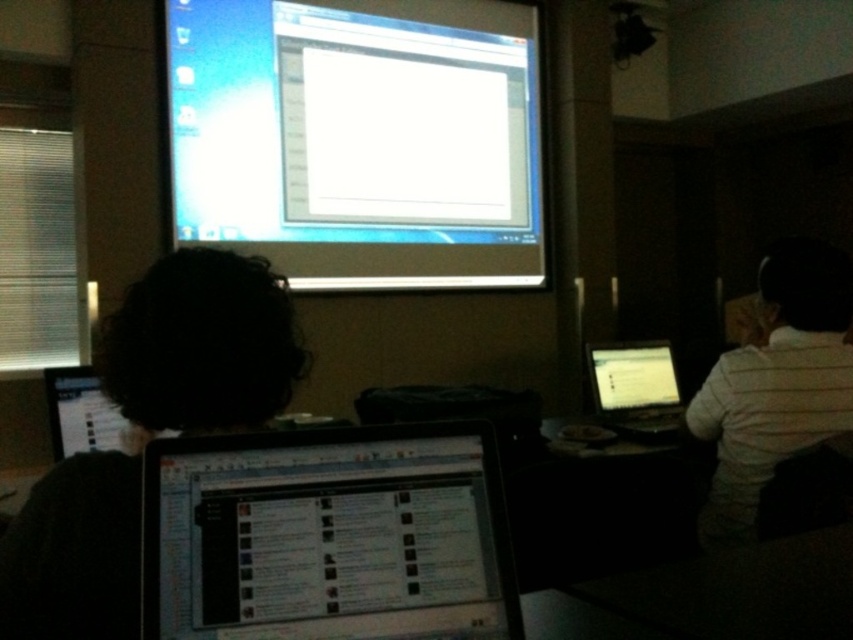
Question: Considering the relative positions of white glossy projector screen at upper center and white striped shirt at right in the image provided, where is white glossy projector screen at upper center located with respect to white striped shirt at right?

Choices:
 (A) left
 (B) right

Answer: (A)

Question: Which of the following is the closest to the observer?

Choices:
 (A) matte black laptop at center
 (B) black matte hair at center
 (C) black glossy laptop at right

Answer: (A)

Question: Estimate the real-world distances between objects in this image. Which object is closer to the matte black laptop at center?

Choices:
 (A) white striped shirt at right
 (B) black matte hair at center
 (C) white glossy projector screen at upper center

Answer: (B)

Question: From the image, what is the correct spatial relationship of white striped shirt at right in relation to black glossy laptop at right?

Choices:
 (A) above
 (B) below

Answer: (A)

Question: Is white glossy projector screen at upper center below matte black laptop at center?

Choices:
 (A) no
 (B) yes

Answer: (A)

Question: Estimate the real-world distances between objects in this image. Which object is closer to the white striped shirt at right?

Choices:
 (A) matte black laptop at center
 (B) black glossy laptop at right

Answer: (B)